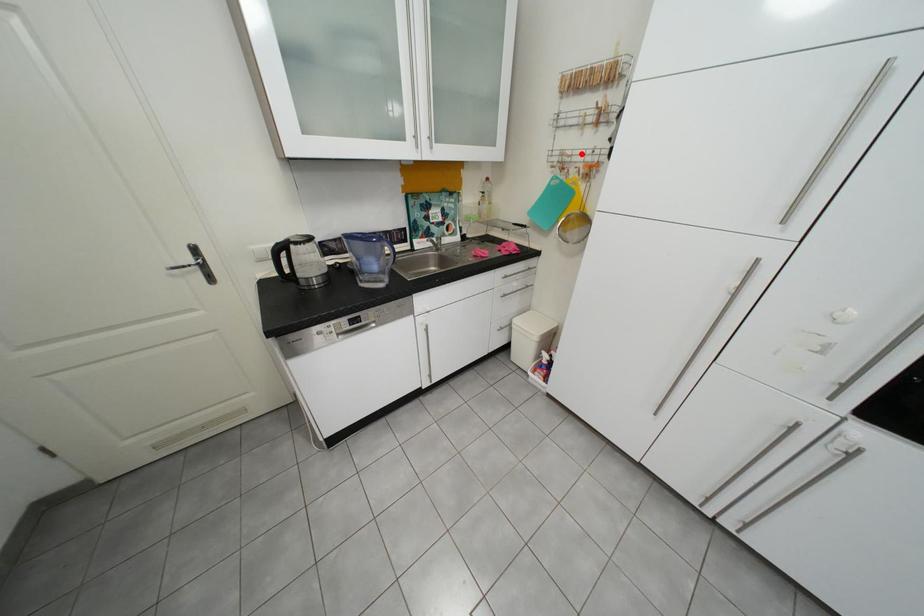
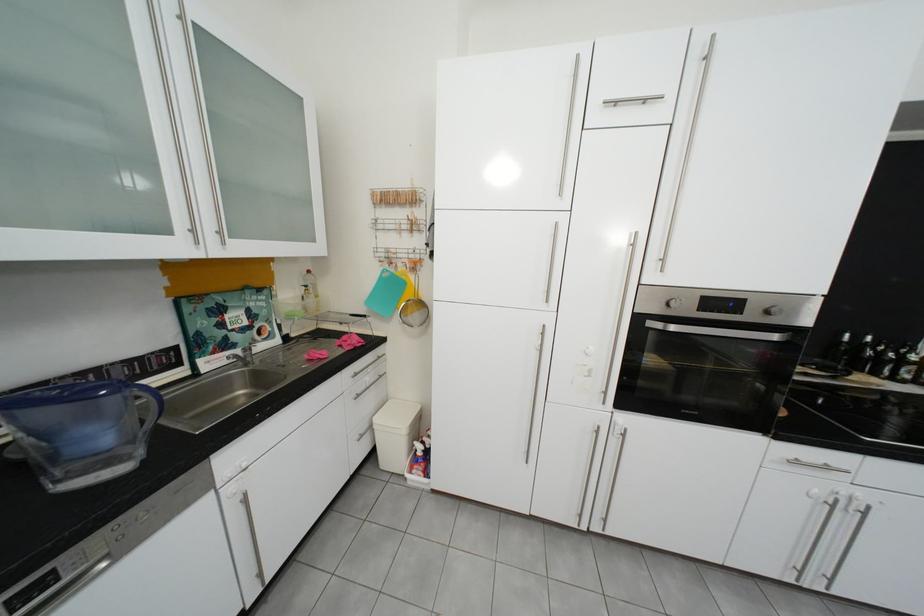
Where in the second image is the point corresponding to the highlighted location from the first image?

(406, 252)